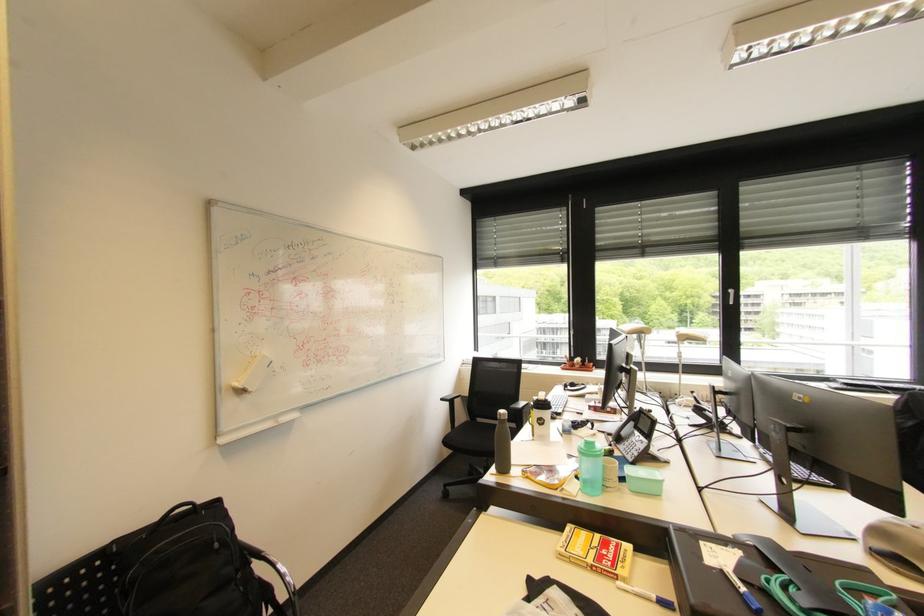
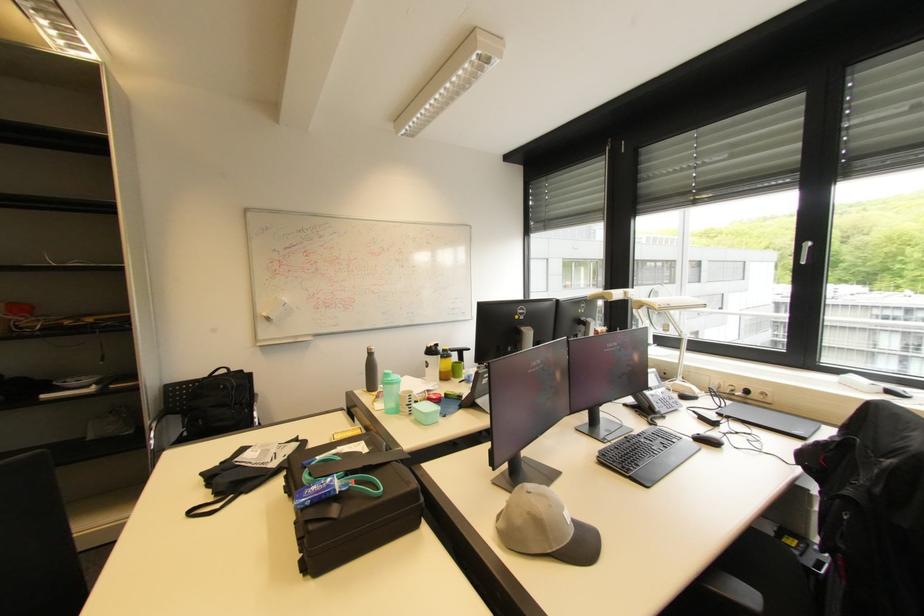
The point at (601,448) is marked in the first image. Where is the corresponding point in the second image?

(394, 379)